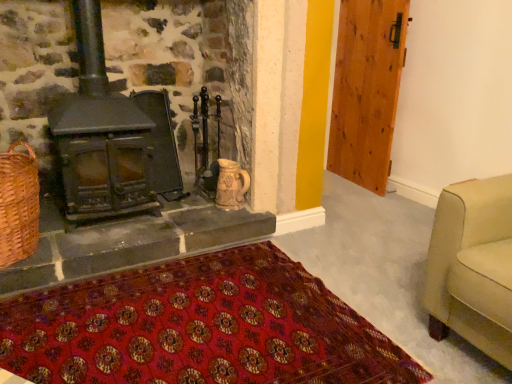
Locate an element on the screen. This screenshot has height=384, width=512. woven brown basket at lower left is located at coordinates (18, 205).

What do you see at coordinates (18, 205) in the screenshot?
I see `woven brown basket at lower left` at bounding box center [18, 205].

What is the approximate height of red woven mat at lower center?

red woven mat at lower center is 2.10 inches tall.

Measure the distance between point (377, 111) and camera.

Point (377, 111) and camera are 9.89 feet apart.

This screenshot has width=512, height=384. Identify the location of woven brown basket at lower left. [x=18, y=205].

Which object is more forward, red woven mat at lower center or matte black wood burning stove at left?

red woven mat at lower center is closer to the camera.

How distant is red woven mat at lower center from matte black wood burning stove at left?

They are 29.11 inches apart.

Looking at this image, from the image's perspective, is red woven mat at lower center positioned above or below matte black wood burning stove at left?

From the image's perspective, red woven mat at lower center appears below matte black wood burning stove at left.

Would you say red woven mat at lower center contains matte black wood burning stove at left?

That's incorrect, matte black wood burning stove at left is not inside red woven mat at lower center.

From the image's perspective, which is below, woven brown basket at lower left or matte black wood burning stove at left?

From the image's view, woven brown basket at lower left is below.

Is woven brown basket at lower left shorter than matte black wood burning stove at left?

Yes.

Which is correct: woven brown basket at lower left is inside matte black wood burning stove at left, or outside of it?

woven brown basket at lower left cannot be found inside matte black wood burning stove at left.

Which of these two, wooden door at right or red woven mat at lower center, is thinner?

wooden door at right.

Measure the distance from wooden door at right to red woven mat at lower center.

wooden door at right is 6.05 feet from red woven mat at lower center.

Which is less distant, (371,140) or (307,335)?

Point (371,140) is positioned farther from the camera compared to point (307,335).

From the image's perspective, between wooden door at right and red woven mat at lower center, which one is located above?

wooden door at right, from the image's perspective.

Who is bigger, matte black wood burning stove at left or woven brown basket at lower left?

With larger size is matte black wood burning stove at left.

Does matte black wood burning stove at left have a lesser height compared to woven brown basket at lower left?

No.

Would you consider matte black wood burning stove at left to be distant from woven brown basket at lower left?

No, there isn't a large distance between matte black wood burning stove at left and woven brown basket at lower left.

The width and height of the screenshot is (512, 384). In order to click on basket in front of the matte black wood burning stove at left in this screenshot , I will do `click(18, 205)`.

Locate an element on the screen. wood burning stove that is below the wooden door at right (from the image's perspective) is located at coordinates (101, 136).

Between matte black wood burning stove at left and wooden door at right, which one has larger width?

Wider between the two is matte black wood burning stove at left.

From the image's perspective, which object appears higher, matte black wood burning stove at left or wooden door at right?

wooden door at right.

Can you tell me how much matte black wood burning stove at left and wooden door at right differ in facing direction?

→ 96.8 degrees separate the facing orientations of matte black wood burning stove at left and wooden door at right.

Is red woven mat at lower center in front of wooden door at right?

Yes, red woven mat at lower center is closer to the camera.

Is red woven mat at lower center at the right side of wooden door at right?

No, red woven mat at lower center is not to the right of wooden door at right.

Between red woven mat at lower center and wooden door at right, which one has more height?

Standing taller between the two is wooden door at right.

Which is behind, point (234, 248) or point (347, 154)?

The point (347, 154) is behind.

The height and width of the screenshot is (384, 512). In order to click on wood burning stove located above the red woven mat at lower center (from the image's perspective) in this screenshot , I will do `click(101, 136)`.

In the scene shown: Is matte black wood burning stove at left at the left side of red woven mat at lower center?

Indeed, matte black wood burning stove at left is positioned on the left side of red woven mat at lower center.

Between matte black wood burning stove at left and red woven mat at lower center, which one has larger width?

red woven mat at lower center is wider.

Is the position of matte black wood burning stove at left more distant than that of red woven mat at lower center?

Yes, it is.

At what (x,y) coordinates should I click in order to perform the action: click on wood burning stove on the left of red woven mat at lower center. Please return your answer as a coordinate pair (x, y). Image resolution: width=512 pixels, height=384 pixels. Looking at the image, I should click on (101, 136).

At what (x,y) coordinates should I click in order to perform the action: click on basket in front of the matte black wood burning stove at left. Please return your answer as a coordinate pair (x, y). This screenshot has width=512, height=384. Looking at the image, I should click on (18, 205).

When comparing their distances from wooden door at right, does woven brown basket at lower left or red woven mat at lower center seem further?

Among the two, woven brown basket at lower left is located further to wooden door at right.

Which object lies nearer to the anchor point matte black wood burning stove at left, woven brown basket at lower left or red woven mat at lower center?

Based on the image, woven brown basket at lower left appears to be nearer to matte black wood burning stove at left.

Which object lies nearer to the anchor point wooden door at right, matte black wood burning stove at left or red woven mat at lower center?

The object closer to wooden door at right is matte black wood burning stove at left.

Looking at the image, which one is located further to woven brown basket at lower left, wooden door at right or red woven mat at lower center?

wooden door at right is further to woven brown basket at lower left.

Based on the photo, which object lies nearer to the anchor point woven brown basket at lower left, matte black wood burning stove at left or red woven mat at lower center?

matte black wood burning stove at left is positioned closer to the anchor woven brown basket at lower left.

Which object lies nearer to the anchor point red woven mat at lower center, woven brown basket at lower left or wooden door at right?

woven brown basket at lower left is closer to red woven mat at lower center.

Considering their positions, is red woven mat at lower center positioned closer to matte black wood burning stove at left than woven brown basket at lower left?

woven brown basket at lower left is positioned closer to the anchor matte black wood burning stove at left.

Based on their spatial positions, is red woven mat at lower center or matte black wood burning stove at left further from wooden door at right?

red woven mat at lower center is positioned further to the anchor wooden door at right.

Find the location of a particular element. The height and width of the screenshot is (384, 512). wood burning stove between red woven mat at lower center and wooden door at right from front to back is located at coordinates (101, 136).

Find the location of a particular element. wood burning stove situated between woven brown basket at lower left and wooden door at right from left to right is located at coordinates (101, 136).

Locate an element on the screen. basket between matte black wood burning stove at left and red woven mat at lower center in the vertical direction is located at coordinates (18, 205).

Locate an element on the screen. mat between woven brown basket at lower left and wooden door at right is located at coordinates (199, 327).